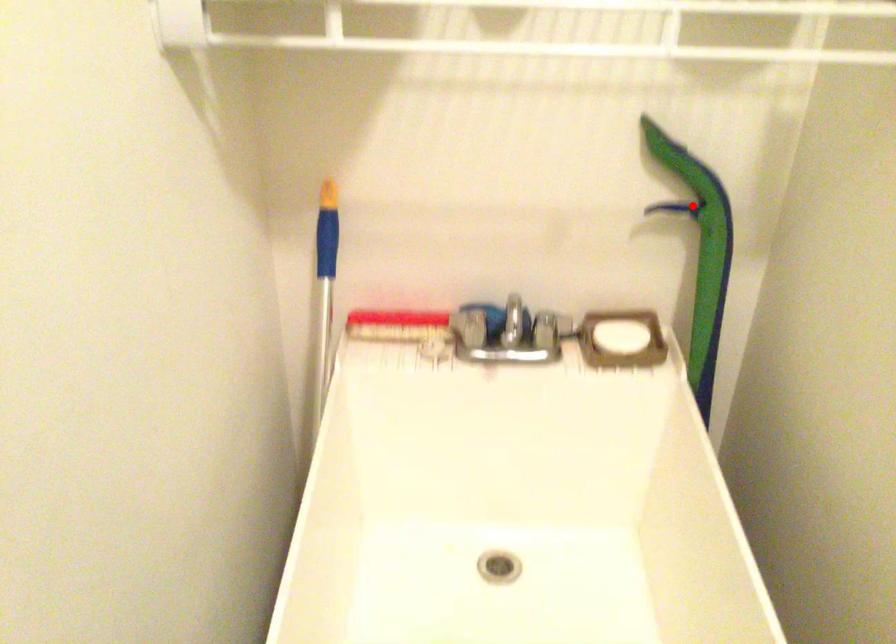
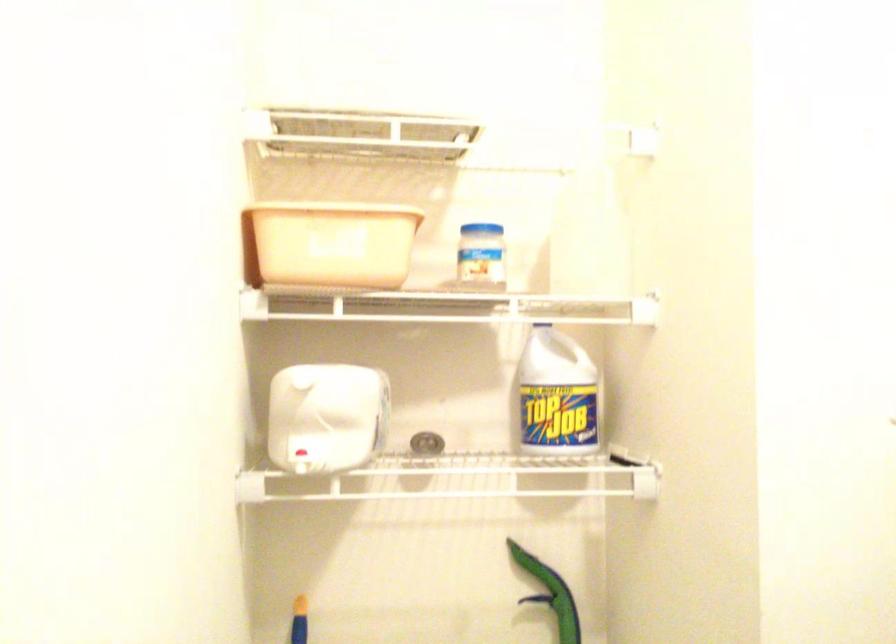
The point at the highlighted location is marked in the first image. Where is the corresponding point in the second image?

(552, 594)